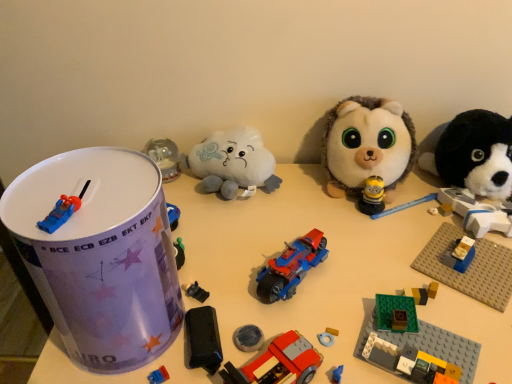
Question: Is point (243, 175) positioned closer to the camera than point (276, 357)?

Choices:
 (A) closer
 (B) farther

Answer: (B)

Question: From a real-world perspective, is white plush cloud at center, which is the third toy in left-to-right order, positioned above or below brick-patterned plastic car at center, acting as the 5th toy starting from the left?

Choices:
 (A) below
 (B) above

Answer: (B)

Question: Estimate the real-world distances between objects in this image. Which object is farther from the fluffy white plush at center, the 2th toy viewed from the right?

Choices:
 (A) green plastic building block at lower right, which is the 7th toy from left to right
 (B) white plush cloud at center, which is the third toy in left-to-right order
 (C) blue plastic car at top left, marked as the 1th toy in a left-to-right arrangement
 (D) black plastic toy car at center, placed as the fourth toy when sorted from left to right
 (E) black plush dog at right, positioned as the 1th toy in right-to-left order

Answer: (C)

Question: Based on their relative distances, which object is nearer to the blue plastic car at top left, marked as the 1th toy in a left-to-right arrangement?

Choices:
 (A) shiny plastic motorcycle at center, which is the sixth toy in left-to-right order
 (B) white plush cloud at center, which is the third toy in left-to-right order
 (C) black plastic toy car at center, which is the 6th toy in right-to-left order
 (D) shiny plastic toy car at left, the eighth toy positioned from the right
 (E) brick-patterned plastic car at center, acting as the 5th toy starting from the left

Answer: (D)